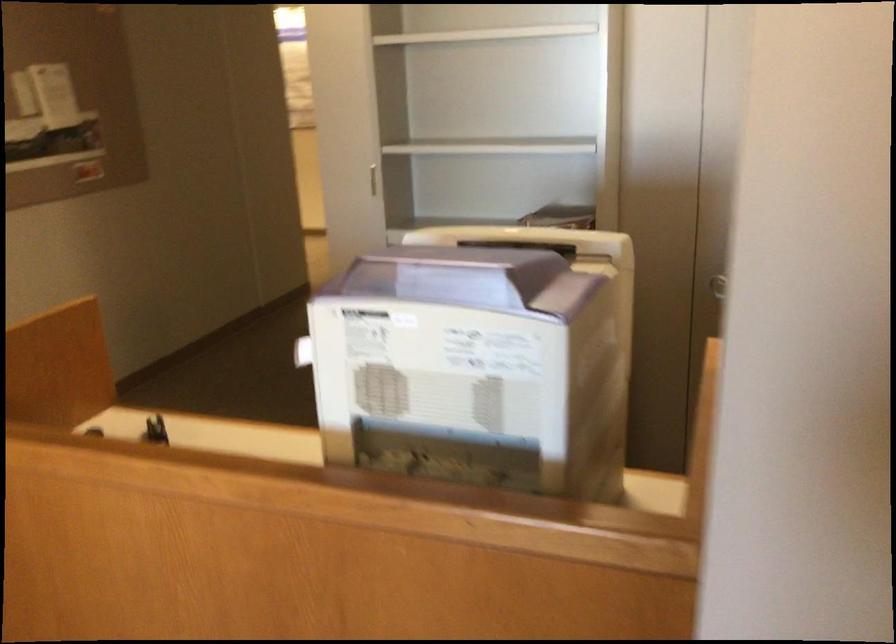
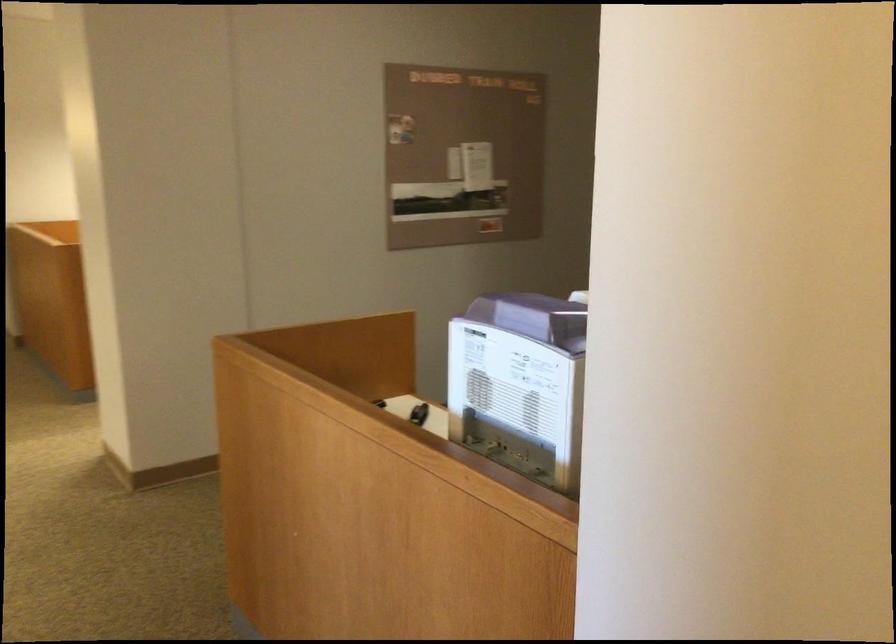
The point at (462, 278) is marked in the first image. Where is the corresponding point in the second image?

(540, 316)